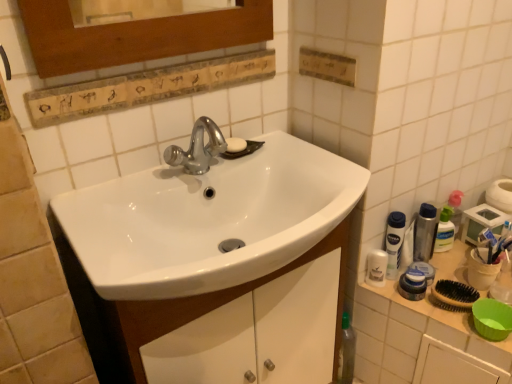
The width and height of the screenshot is (512, 384). I want to click on free space in front of translucent plastic mouthwash at right, the 3th mouthwash in the right-to-left sequence, so click(438, 321).